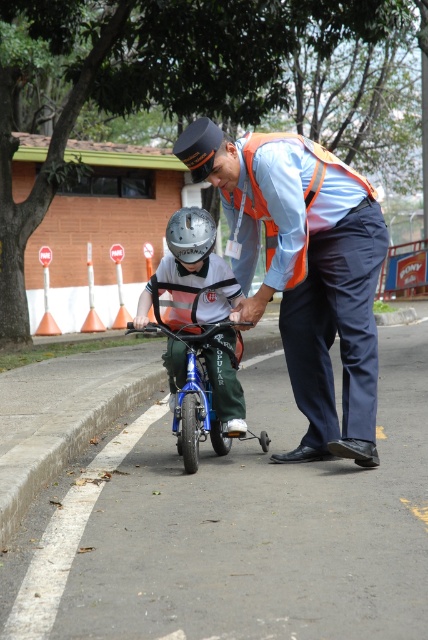
Which is behind, point (323, 179) or point (225, 314)?

Positioned behind is point (225, 314).

Is orange reflective safety vest at center to the right of metallic helmet at center from the viewer's perspective?

Yes, orange reflective safety vest at center is to the right of metallic helmet at center.

Is point (306, 259) closer to camera compared to point (202, 214)?

Yes, point (306, 259) is in front of point (202, 214).

The height and width of the screenshot is (640, 428). I want to click on orange reflective safety vest at center, so click(x=287, y=202).

Is point (357, 189) more distant than point (186, 256)?

No, (357, 189) is in front of (186, 256).

Does point (240, 216) come in front of point (175, 221)?

No, it is not.

Between point (290, 216) and point (211, 221), which one is positioned behind?

The point (211, 221) is more distant.

Locate an element on the screen. The height and width of the screenshot is (640, 428). orange reflective safety vest at center is located at coordinates (287, 202).

Looking at this image, does orange reflective vest at center appear on the right side of blue metallic bicycle at center?

Yes, orange reflective vest at center is to the right of blue metallic bicycle at center.

The height and width of the screenshot is (640, 428). I want to click on orange reflective vest at center, so click(x=305, y=269).

This screenshot has width=428, height=640. What are the coordinates of `orange reflective vest at center` in the screenshot? It's located at (305, 269).